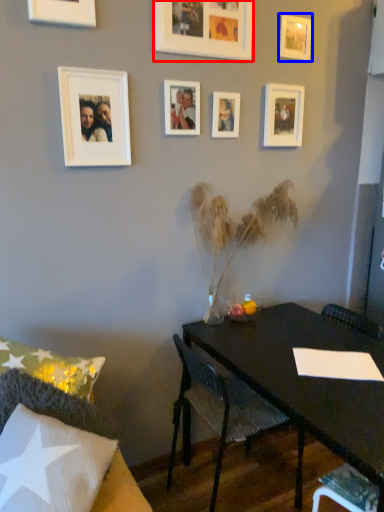
Question: Among these objects, which one is farthest to the camera, picture frame (highlighted by a red box) or picture frame (highlighted by a blue box)?

Choices:
 (A) picture frame
 (B) picture frame

Answer: (B)